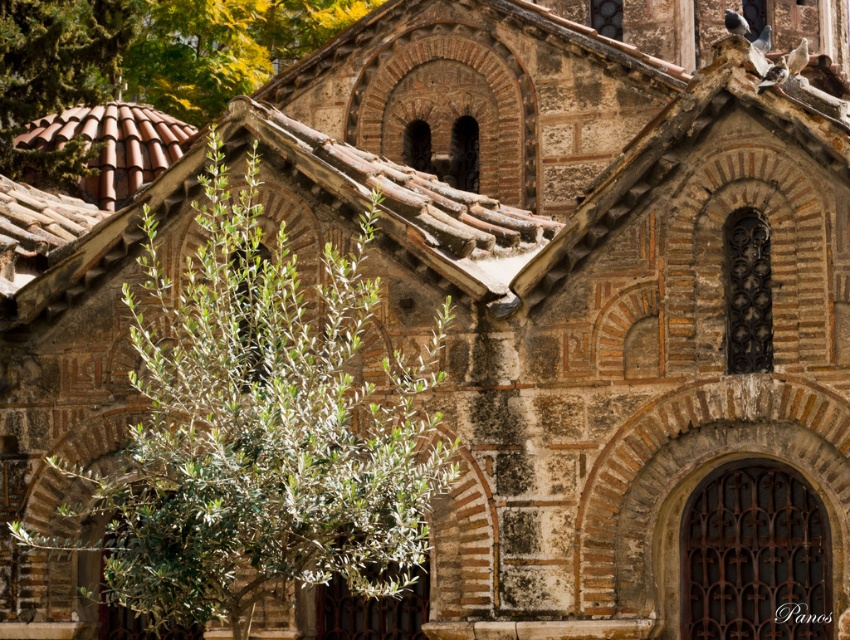
Question: Which object is farther from the camera taking this photo?

Choices:
 (A) green leafy plant at left
 (B) green leafy tree at upper left

Answer: (B)

Question: Among these points, which one is farthest from the camera?

Choices:
 (A) (384, 464)
 (B) (197, 22)

Answer: (B)

Question: Is green leafy plant at left to the left of green leafy tree at upper left from the viewer's perspective?

Choices:
 (A) no
 (B) yes

Answer: (A)

Question: Which object appears farthest from the camera in this image?

Choices:
 (A) green leafy tree at upper left
 (B) green leafy plant at left

Answer: (A)

Question: Does green leafy plant at left have a lesser width compared to green leafy tree at upper left?

Choices:
 (A) no
 (B) yes

Answer: (A)

Question: Where is green leafy plant at left located in relation to green leafy tree at upper left in the image?

Choices:
 (A) below
 (B) above

Answer: (A)